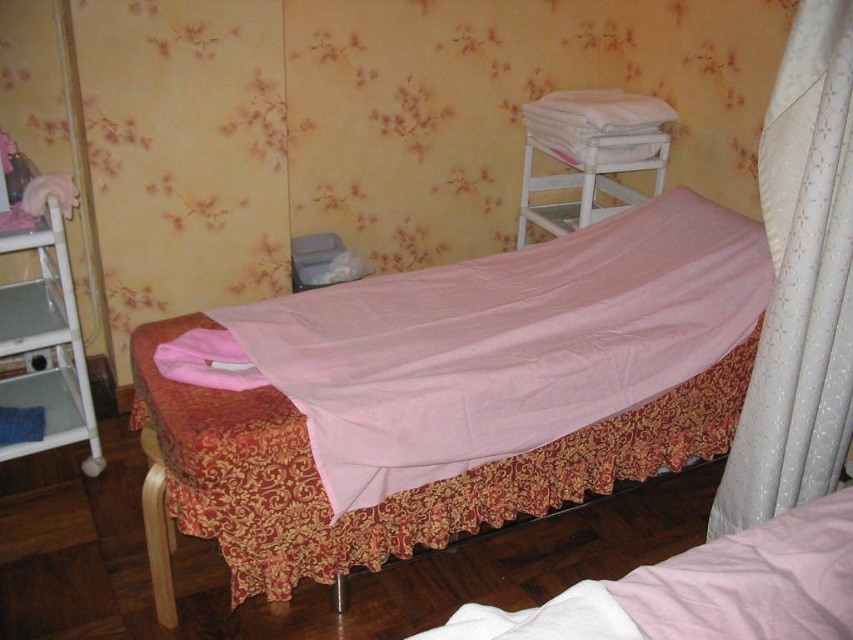
You are a guest in this room and want to place a small plant between the matte pink fabric at left and the white wooden bunk bed at upper center. Which object should you place the plant closer to if you want it to be nearer to you?

You should place the plant closer to the matte pink fabric at left because it is nearer to the viewer compared to the white wooden bunk bed at upper center.